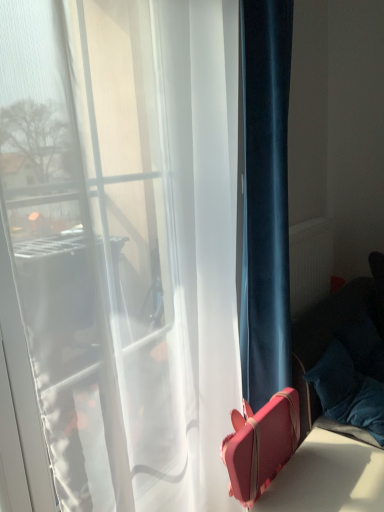
Question: Are pink leather suitcase at lower right and velvety blue pillow at lower right far apart?

Choices:
 (A) no
 (B) yes

Answer: (A)

Question: Is pink leather suitcase at lower right outside of velvety blue pillow at lower right?

Choices:
 (A) no
 (B) yes

Answer: (B)

Question: From the image's perspective, is pink leather suitcase at lower right over velvety blue pillow at lower right?

Choices:
 (A) yes
 (B) no

Answer: (B)

Question: Considering the relative sizes of pink leather suitcase at lower right and velvety blue pillow at lower right in the image provided, is pink leather suitcase at lower right smaller than velvety blue pillow at lower right?

Choices:
 (A) yes
 (B) no

Answer: (B)

Question: From a real-world perspective, is pink leather suitcase at lower right positioned over velvety blue pillow at lower right based on gravity?

Choices:
 (A) no
 (B) yes

Answer: (A)

Question: Is pink leather suitcase at lower right aimed at velvety blue pillow at lower right?

Choices:
 (A) no
 (B) yes

Answer: (A)

Question: From a real-world perspective, is velvety blue pillow at lower right physically above pink leather suitcase at lower right?

Choices:
 (A) yes
 (B) no

Answer: (A)

Question: Can you confirm if velvety blue pillow at lower right is shorter than pink leather suitcase at lower right?

Choices:
 (A) no
 (B) yes

Answer: (B)

Question: From the image's perspective, does velvety blue pillow at lower right appear lower than pink leather suitcase at lower right?

Choices:
 (A) no
 (B) yes

Answer: (A)

Question: Does velvety blue pillow at lower right have a greater width compared to pink leather suitcase at lower right?

Choices:
 (A) no
 (B) yes

Answer: (B)

Question: Is the position of velvety blue pillow at lower right less distant than that of pink leather suitcase at lower right?

Choices:
 (A) no
 (B) yes

Answer: (A)

Question: Is velvety blue pillow at lower right placed right next to pink leather suitcase at lower right?

Choices:
 (A) yes
 (B) no

Answer: (B)

Question: Would you say matte white radiator at right is a long distance from velvety blue pillow at lower right?

Choices:
 (A) yes
 (B) no

Answer: (B)